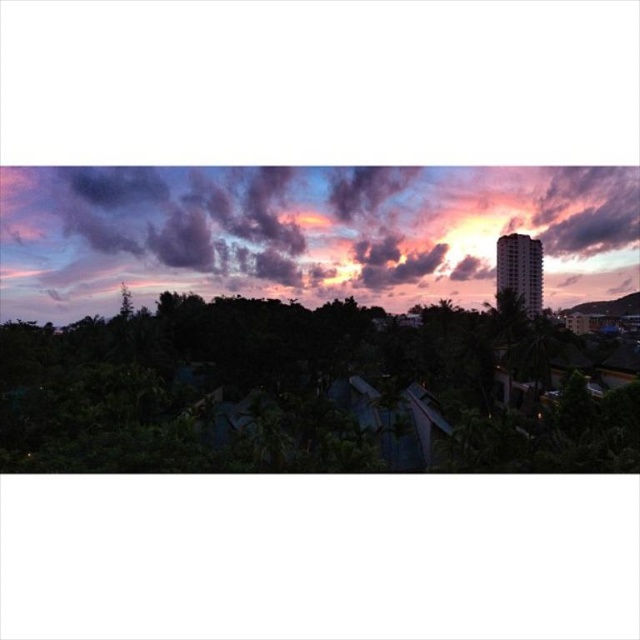
Question: Can you confirm if green leafy tree at lower left is bigger than purple matte cloud at upper center?

Choices:
 (A) no
 (B) yes

Answer: (A)

Question: Is green leafy tree at lower left bigger than purple matte cloud at upper center?

Choices:
 (A) yes
 (B) no

Answer: (B)

Question: Can you confirm if green leafy tree at lower left is thinner than purple matte cloud at upper center?

Choices:
 (A) yes
 (B) no

Answer: (A)

Question: Which object appears farthest from the camera in this image?

Choices:
 (A) purple matte cloud at upper center
 (B) green leafy tree at lower left

Answer: (A)